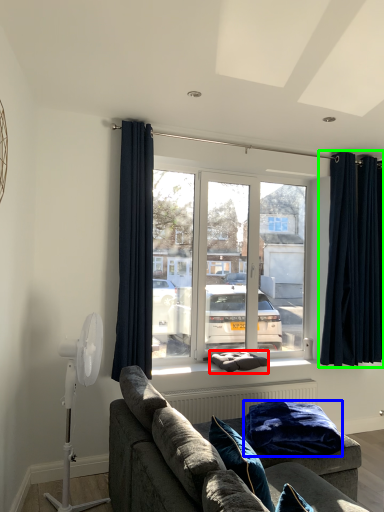
Question: Estimate the real-world distances between objects in this image. Which object is closer to pillow (highlighted by a red box), blanket (highlighted by a blue box) or curtain (highlighted by a green box)?

Choices:
 (A) blanket
 (B) curtain

Answer: (A)